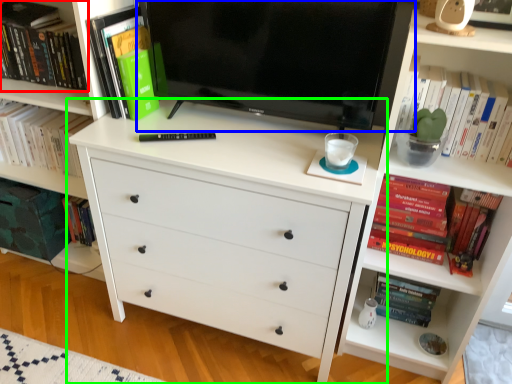
Question: Considering the real-world distances, which object is farthest from book (highlighted by a red box)? television (highlighted by a blue box) or chest of drawers (highlighted by a green box)?

Choices:
 (A) television
 (B) chest of drawers

Answer: (B)